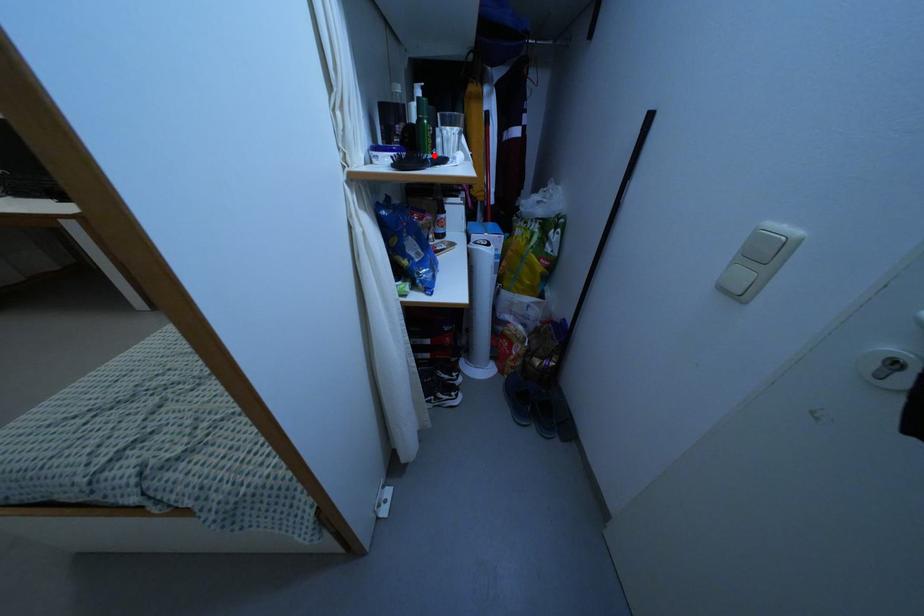
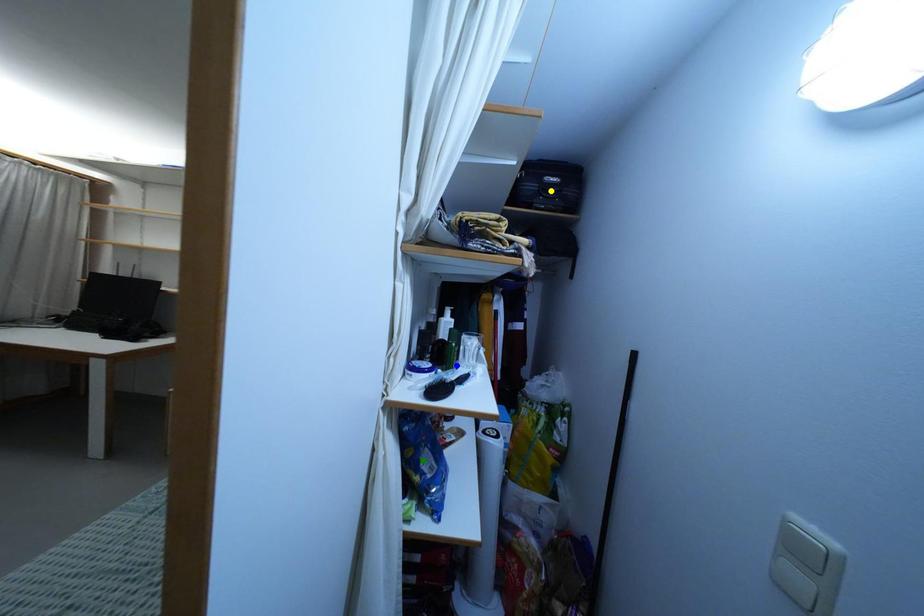
Question: I am providing you with two images of the same scene from different viewpoints. A red point is marked on the first image. You are given multiple points on the second image. In image 2, which mark is for the same physical point as the one in image 1?

Choices:
 (A) green point
 (B) yellow point
 (C) blue point

Answer: (C)